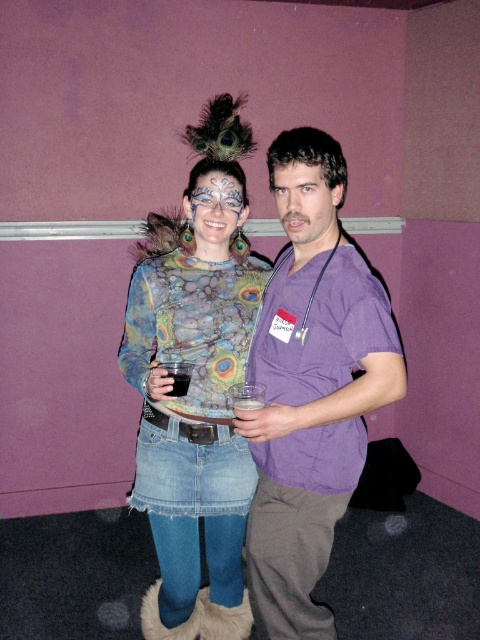
You are a photographer at a social event and want to ensure both the textured peacock feather dress at center and the smooth skin face at center are clearly visible in your photo. Given their sizes, which one might you need to adjust your camera focus for more carefully?

The textured peacock feather dress at center is larger in size than the smooth skin face at center, so you might need to adjust your camera focus more carefully for the textured peacock feather dress at center to ensure its details are sharp.

In the scene shown: You are taking a photo of two people at a social event. You notice two points in the image labeled as point 1 and point 2. Point 1 is located at coordinates [310,241] and point 2 is at [206,198]. Based on their positions, which point is more likely to be in focus if you focus on the person closer to the camera?

Point 1 is closer to the camera than point 2, so if you focus on the person closer to the camera, point 1 would be more in focus.